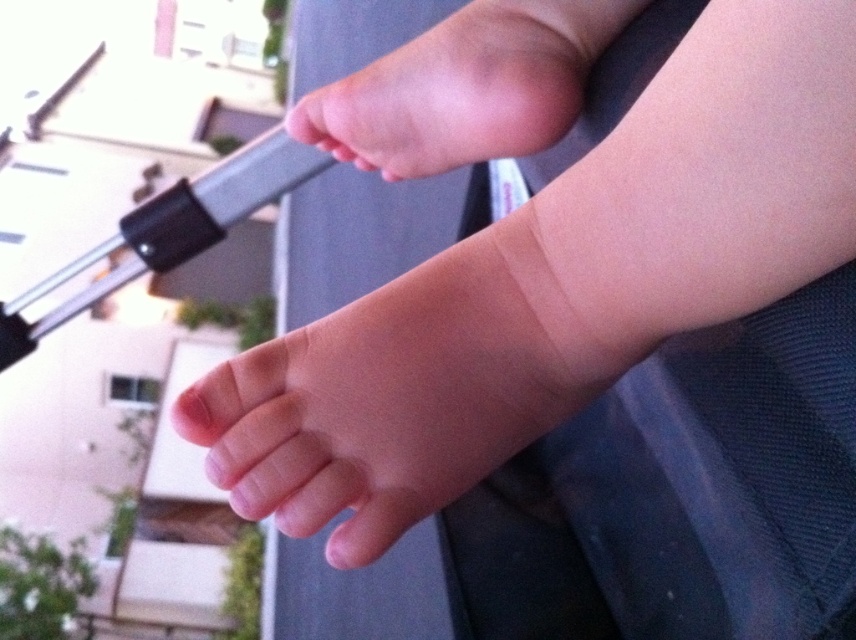
Question: Is pink smooth foot at center to the right of pink smooth foot at upper center from the viewer's perspective?

Choices:
 (A) no
 (B) yes

Answer: (A)

Question: Among these objects, which one is farthest from the camera?

Choices:
 (A) pink smooth foot at upper center
 (B) pink smooth foot at center

Answer: (A)

Question: Does pink smooth foot at center have a larger size compared to pink smooth foot at upper center?

Choices:
 (A) no
 (B) yes

Answer: (A)

Question: Is pink smooth foot at center closer to the viewer compared to pink smooth foot at upper center?

Choices:
 (A) no
 (B) yes

Answer: (B)

Question: Which point appears farthest from the camera in this image?

Choices:
 (A) (474, 160)
 (B) (331, 422)

Answer: (A)